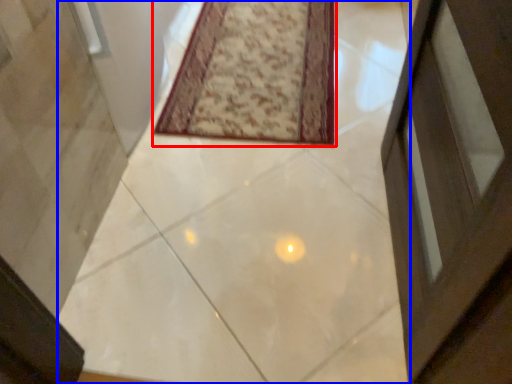
Question: Which object appears closest to the camera in this image, mat (highlighted by a red box) or concrete (highlighted by a blue box)?

Choices:
 (A) mat
 (B) concrete

Answer: (B)